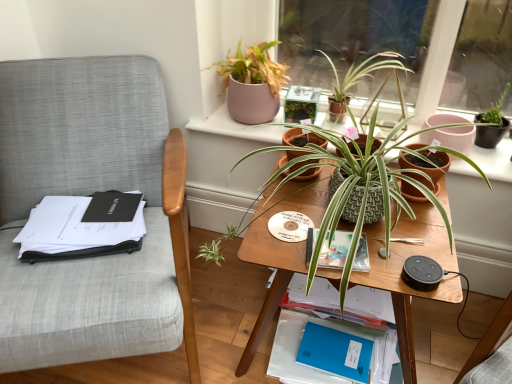
Question: Would you say hardcover book at center, arranged as the 2th paperback book when ordered from the bottom, is a long distance from blue matte paperback book at lower center, which is the 1th paperback book in back-to-front order?

Choices:
 (A) no
 (B) yes

Answer: (A)

Question: Is hardcover book at center, which is the first paperback book from front to back, closer to the viewer compared to blue matte paperback book at lower center, the first paperback book from the bottom?

Choices:
 (A) no
 (B) yes

Answer: (B)

Question: From the image's perspective, is hardcover book at center, arranged as the 2th paperback book when ordered from the bottom, below blue matte paperback book at lower center, the second paperback book in the front-to-back sequence?

Choices:
 (A) no
 (B) yes

Answer: (A)

Question: Are hardcover book at center, arranged as the 2th paperback book when ordered from the bottom, and blue matte paperback book at lower center, the second paperback book in the front-to-back sequence, beside each other?

Choices:
 (A) yes
 (B) no

Answer: (B)

Question: Is hardcover book at center, which is the first paperback book from front to back, further to the viewer compared to blue matte paperback book at lower center, the second paperback book in the front-to-back sequence?

Choices:
 (A) yes
 (B) no

Answer: (B)

Question: Considering the relative sizes of hardcover book at center, which is the first paperback book from front to back, and blue matte paperback book at lower center, the first paperback book from the bottom, in the image provided, is hardcover book at center, which is the first paperback book from front to back, smaller than blue matte paperback book at lower center, the first paperback book from the bottom,?

Choices:
 (A) yes
 (B) no

Answer: (A)

Question: Considering the relative sizes of terracotta clay pot at center-right, the 1th flowerpot viewed from the right, and blue matte notebook at lower center in the image provided, is terracotta clay pot at center-right, the 1th flowerpot viewed from the right, wider than blue matte notebook at lower center?

Choices:
 (A) yes
 (B) no

Answer: (B)

Question: Is terracotta clay pot at center-right, the 1th flowerpot viewed from the right, at the right side of blue matte notebook at lower center?

Choices:
 (A) yes
 (B) no

Answer: (A)

Question: Is terracotta clay pot at center-right, which is counted as the second flowerpot, starting from the left, placed right next to blue matte notebook at lower center?

Choices:
 (A) no
 (B) yes

Answer: (A)

Question: Is terracotta clay pot at center-right, which is counted as the second flowerpot, starting from the left, facing away from blue matte notebook at lower center?

Choices:
 (A) yes
 (B) no

Answer: (B)

Question: From the image's perspective, would you say terracotta clay pot at center-right, which is counted as the second flowerpot, starting from the left, is positioned over blue matte notebook at lower center?

Choices:
 (A) yes
 (B) no

Answer: (A)

Question: Can you confirm if terracotta clay pot at center-right, which is counted as the second flowerpot, starting from the left, is bigger than blue matte notebook at lower center?

Choices:
 (A) no
 (B) yes

Answer: (B)

Question: Is textured terracotta pot at center, which is the first houseplant in bottom-to-top order, in front of blue matte paperback book at lower center, which ranks as the 2th paperback book in top-to-bottom order?

Choices:
 (A) yes
 (B) no

Answer: (A)